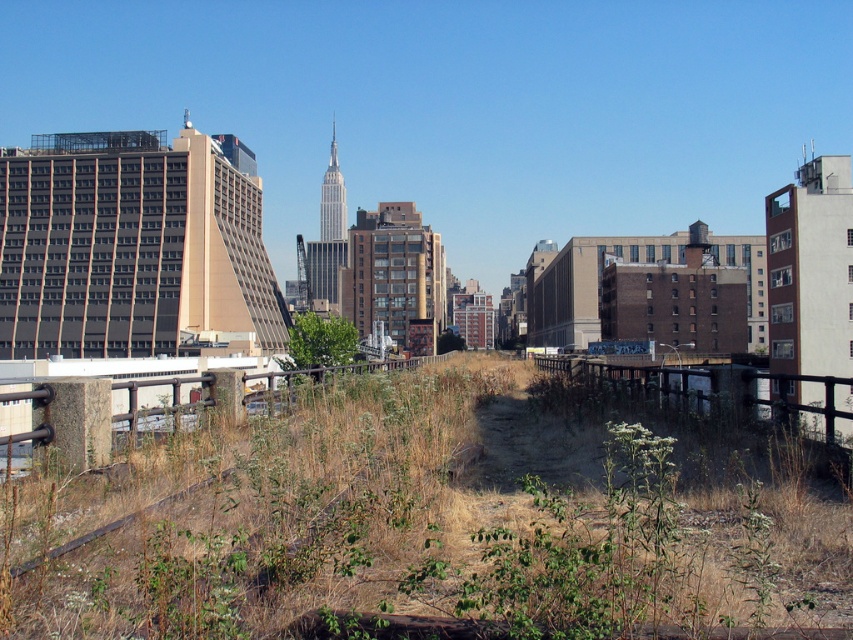
Question: Which of the following is the closest to the observer?

Choices:
 (A) (308, 362)
 (B) (444, 593)

Answer: (B)

Question: Is dry grass at center below green leafy tree at center?

Choices:
 (A) yes
 (B) no

Answer: (B)

Question: Is dry grass at center positioned behind green leafy tree at center?

Choices:
 (A) yes
 (B) no

Answer: (B)

Question: Among these points, which one is farthest from the camera?

Choices:
 (A) (297, 337)
 (B) (824, 525)

Answer: (A)

Question: Can you confirm if dry grass at center is smaller than green leafy tree at center?

Choices:
 (A) yes
 (B) no

Answer: (A)